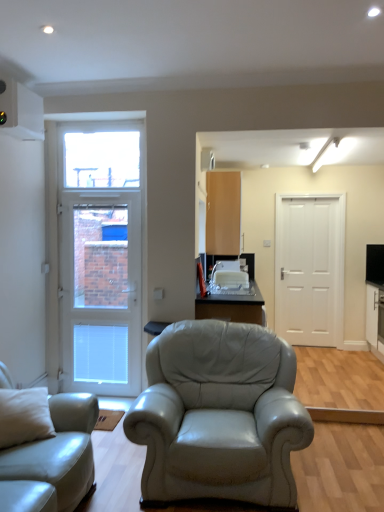
Question: From the image's perspective, is matte wood cabinet at upper center below transparent glass window at upper left?

Choices:
 (A) yes
 (B) no

Answer: (A)

Question: Does matte wood cabinet at upper center have a greater width compared to transparent glass window at upper left?

Choices:
 (A) no
 (B) yes

Answer: (B)

Question: From the image's perspective, does matte wood cabinet at upper center appear higher than transparent glass window at upper left?

Choices:
 (A) yes
 (B) no

Answer: (B)

Question: From a real-world perspective, is matte wood cabinet at upper center located higher than transparent glass window at upper left?

Choices:
 (A) yes
 (B) no

Answer: (B)

Question: Is matte wood cabinet at upper center oriented towards transparent glass window at upper left?

Choices:
 (A) no
 (B) yes

Answer: (A)

Question: Is white glossy cabinet at right to the left or to the right of matte black table at center in the image?

Choices:
 (A) left
 (B) right

Answer: (B)

Question: Is white glossy cabinet at right bigger or smaller than matte black table at center?

Choices:
 (A) small
 (B) big

Answer: (A)

Question: Is white glossy cabinet at right taller or shorter than matte black table at center?

Choices:
 (A) short
 (B) tall

Answer: (B)

Question: Do you think white glossy cabinet at right is within matte black table at center, or outside of it?

Choices:
 (A) outside
 (B) inside

Answer: (A)

Question: Considering the positions of transparent glass window at upper left and matte black table at center in the image, is transparent glass window at upper left taller or shorter than matte black table at center?

Choices:
 (A) tall
 (B) short

Answer: (A)

Question: Is transparent glass window at upper left wider or thinner than matte black table at center?

Choices:
 (A) wide
 (B) thin

Answer: (B)

Question: Based on their positions, is transparent glass window at upper left located to the left or right of matte black table at center?

Choices:
 (A) left
 (B) right

Answer: (A)

Question: From the image's perspective, is transparent glass window at upper left located above or below matte black table at center?

Choices:
 (A) below
 (B) above

Answer: (B)

Question: In terms of width, does white glossy door at left, the 2th door viewed from the right, look wider or thinner when compared to white glossy cabinet at right?

Choices:
 (A) wide
 (B) thin

Answer: (B)

Question: From the image's perspective, relative to white glossy cabinet at right, is white glossy door at left, the 2th door viewed from the right, above or below?

Choices:
 (A) above
 (B) below

Answer: (A)